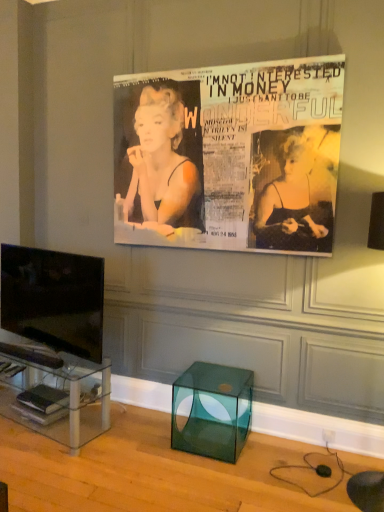
Question: Is matte black poster at upper center thinner than clear glass tv stand at lower left?

Choices:
 (A) yes
 (B) no

Answer: (A)

Question: Is matte black poster at upper center positioned behind clear glass tv stand at lower left?

Choices:
 (A) no
 (B) yes

Answer: (A)

Question: Is matte black poster at upper center beside clear glass tv stand at lower left?

Choices:
 (A) yes
 (B) no

Answer: (B)

Question: From the image's perspective, is matte black poster at upper center located above clear glass tv stand at lower left?

Choices:
 (A) no
 (B) yes

Answer: (B)

Question: From a real-world perspective, is matte black poster at upper center below clear glass tv stand at lower left?

Choices:
 (A) no
 (B) yes

Answer: (A)

Question: Considering the relative positions of matte black magazine at lower left, placed as the 2th magazine when sorted from bottom to top, and transparent glass cube at lower center in the image provided, is matte black magazine at lower left, placed as the 2th magazine when sorted from bottom to top, to the left or to the right of transparent glass cube at lower center?

Choices:
 (A) right
 (B) left

Answer: (B)

Question: Is matte black magazine at lower left, placed as the 2th magazine when sorted from bottom to top, taller or shorter than transparent glass cube at lower center?

Choices:
 (A) short
 (B) tall

Answer: (A)

Question: Is matte black magazine at lower left, which ranks as the second magazine in top-to-bottom order, wider or thinner than transparent glass cube at lower center?

Choices:
 (A) wide
 (B) thin

Answer: (B)

Question: Relative to transparent glass cube at lower center, is matte black magazine at lower left, placed as the 2th magazine when sorted from bottom to top, in front or behind?

Choices:
 (A) behind
 (B) front

Answer: (A)

Question: Does point (66, 407) appear closer or farther from the camera than point (54, 260)?

Choices:
 (A) closer
 (B) farther

Answer: (A)

Question: Is hardcover book at lower left, marked as the first magazine in a bottom-to-top arrangement, situated inside black glossy tv at left or outside?

Choices:
 (A) outside
 (B) inside

Answer: (A)

Question: Based on their positions, is hardcover book at lower left, arranged as the 3th magazine when viewed from the top, located to the left or right of black glossy tv at left?

Choices:
 (A) left
 (B) right

Answer: (A)

Question: Considering the positions of hardcover book at lower left, arranged as the 3th magazine when viewed from the top, and black glossy tv at left in the image, is hardcover book at lower left, arranged as the 3th magazine when viewed from the top, wider or thinner than black glossy tv at left?

Choices:
 (A) thin
 (B) wide

Answer: (B)

Question: Is matte black poster at upper center bigger or smaller than hardcover book at lower left, marked as the first magazine in a bottom-to-top arrangement?

Choices:
 (A) big
 (B) small

Answer: (A)

Question: Relative to hardcover book at lower left, arranged as the 3th magazine when viewed from the top, is matte black poster at upper center in front or behind?

Choices:
 (A) front
 (B) behind

Answer: (A)